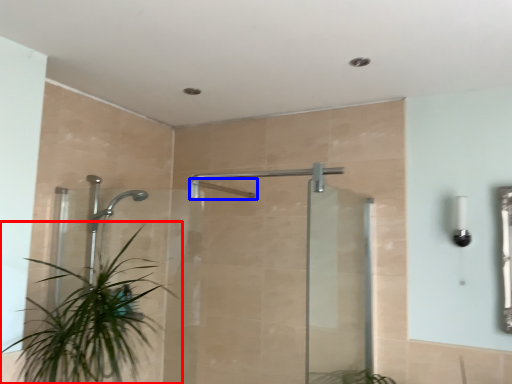
Question: Which object appears farthest to the camera in this image, houseplant (highlighted by a red box) or shower (highlighted by a blue box)?

Choices:
 (A) houseplant
 (B) shower

Answer: (B)